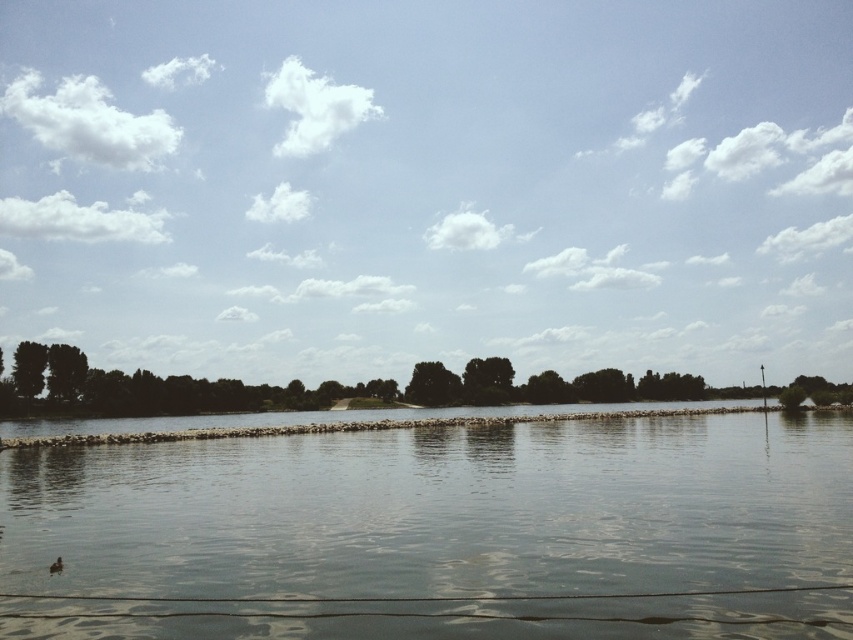
In order to click on gray stone river at center in this screenshot , I will do `click(438, 532)`.

Can you confirm if gray stone river at center is thinner than brown fuzzy duck at lower left?

No.

This screenshot has width=853, height=640. I want to click on gray stone river at center, so click(x=438, y=532).